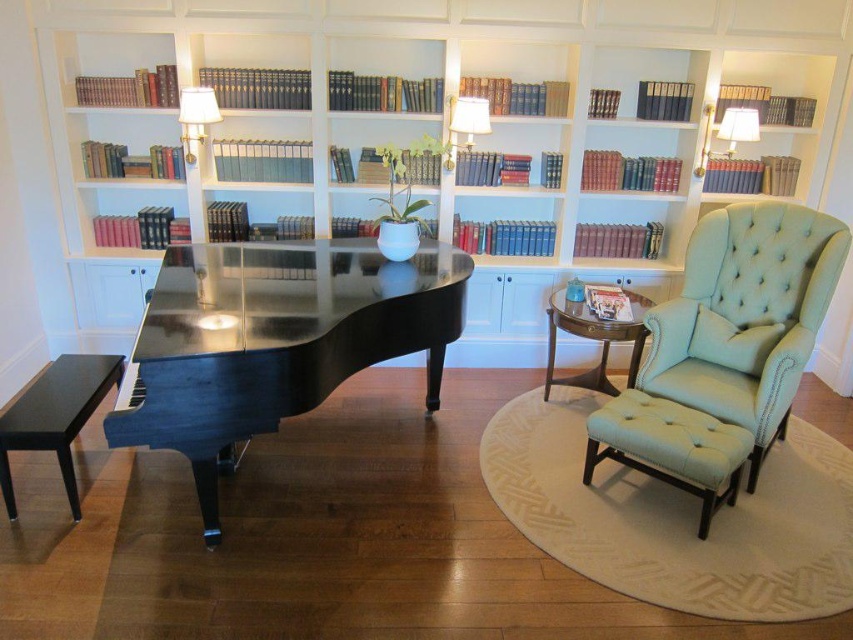
You are standing in the room and want to place a new decorative item on the surface closest to you between the glossy black piano at center and the mahogany wood side table at center. Which object should you choose?

The glossy black piano at center is in front of the mahogany wood side table at center, so the surface closest to you is the glossy black piano at center. Place the decorative item there.

You are standing at the camera position in the room and want to reach point (178,1). The space between you and the point is narrow. Can you walk through it without bending or turning sideways?

The distance between you and point (178,1) is 11.42 feet, which is more than enough space to walk through without bending or turning sideways.